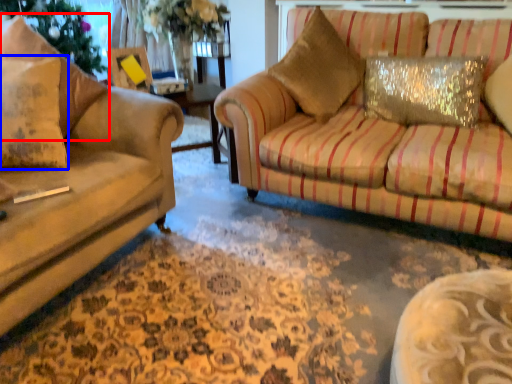
Question: Which of the following is the farthest to the observer, pillow (highlighted by a red box) or pillow (highlighted by a blue box)?

Choices:
 (A) pillow
 (B) pillow

Answer: (B)